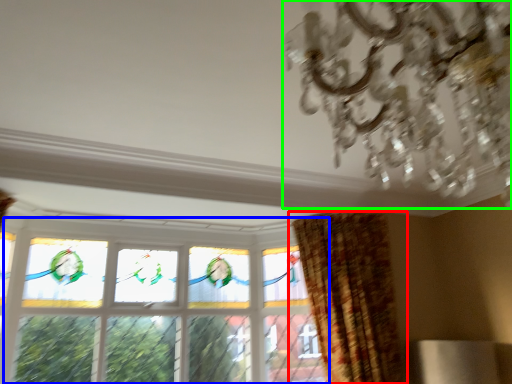
Question: Which is nearer to the curtain (highlighted by a red box)? window (highlighted by a blue box) or chandelier (highlighted by a green box).

Choices:
 (A) window
 (B) chandelier

Answer: (A)